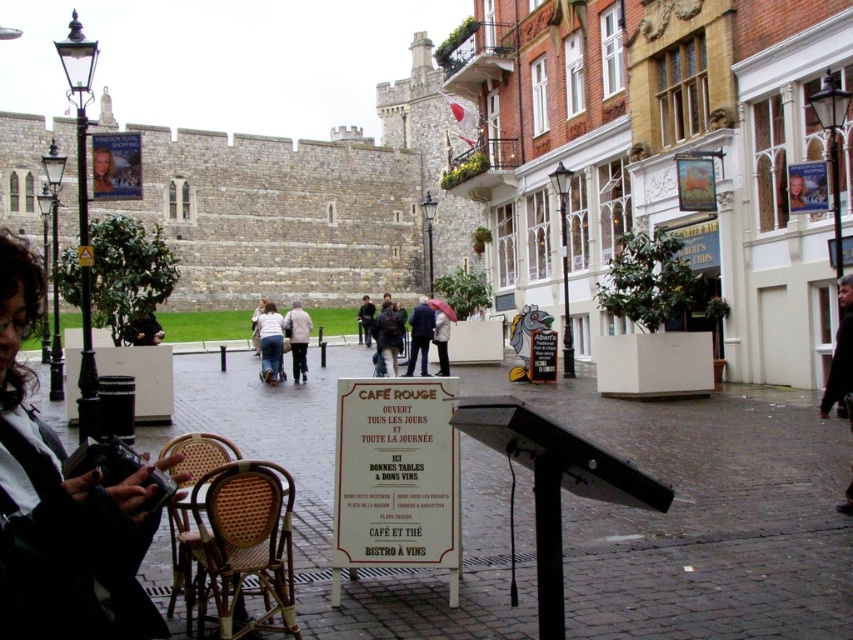
Question: Among these points, which one is farthest from the camera?

Choices:
 (A) (845, 598)
 (B) (412, 339)
 (C) (834, 365)
 (D) (405, 442)

Answer: (B)

Question: Considering the relative positions of dark brown leather jacket at lower right and light beige sweater at center in the image provided, where is dark brown leather jacket at lower right located with respect to light beige sweater at center?

Choices:
 (A) right
 (B) left

Answer: (A)

Question: Which point is closer to the camera?

Choices:
 (A) matte black portrait at upper left
 (B) dark blue jacket at center
 (C) dark brown leather jacket at lower left
 (D) light beige jacket at center

Answer: (A)

Question: Observing the image, what is the correct spatial positioning of dark brown leather jacket at lower right in reference to dark brown leather jacket at lower left?

Choices:
 (A) left
 (B) right

Answer: (B)

Question: Among these objects, which one is nearest to the camera?

Choices:
 (A) denim pants at center
 (B) woven wicker chair at lower left
 (C) dark blue jacket at center

Answer: (B)

Question: Is dark blue jacket at center above dark brown leather jacket at center?

Choices:
 (A) yes
 (B) no

Answer: (B)